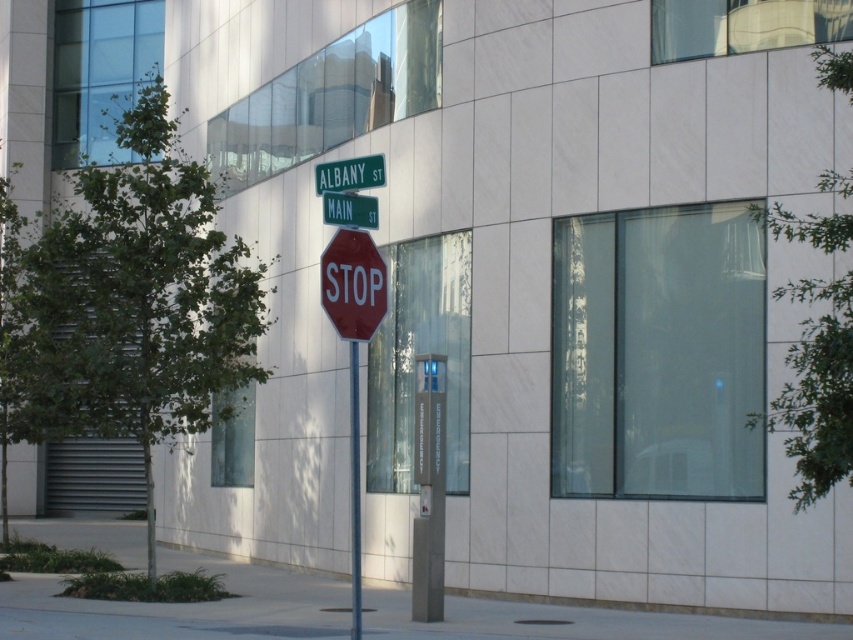
Based on the photo, which is above, metallic pole at center or red stop sign at center?

Positioned higher is red stop sign at center.

Who is more forward, (352, 474) or (379, 172)?

Point (379, 172)

Identify the location of metallic pole at center. This screenshot has width=853, height=640. (354, 492).

Find the location of a particular element. This screenshot has width=853, height=640. red glossy stop sign at center is located at coordinates (352, 284).

Can you confirm if red glossy stop sign at center is wider than red stop sign at center?

In fact, red glossy stop sign at center might be narrower than red stop sign at center.

Is point (351, 317) positioned after point (349, 166)?

That is False.

Where is `red glossy stop sign at center`? This screenshot has height=640, width=853. red glossy stop sign at center is located at coordinates (352, 284).

Is metallic pole at center thinner than red matte stop sign at center?

In fact, metallic pole at center might be wider than red matte stop sign at center.

Who is more distant from viewer, (350, 342) or (351, 204)?

Positioned behind is point (351, 204).

Image resolution: width=853 pixels, height=640 pixels. What are the coordinates of `metallic pole at center` in the screenshot? It's located at (354, 492).